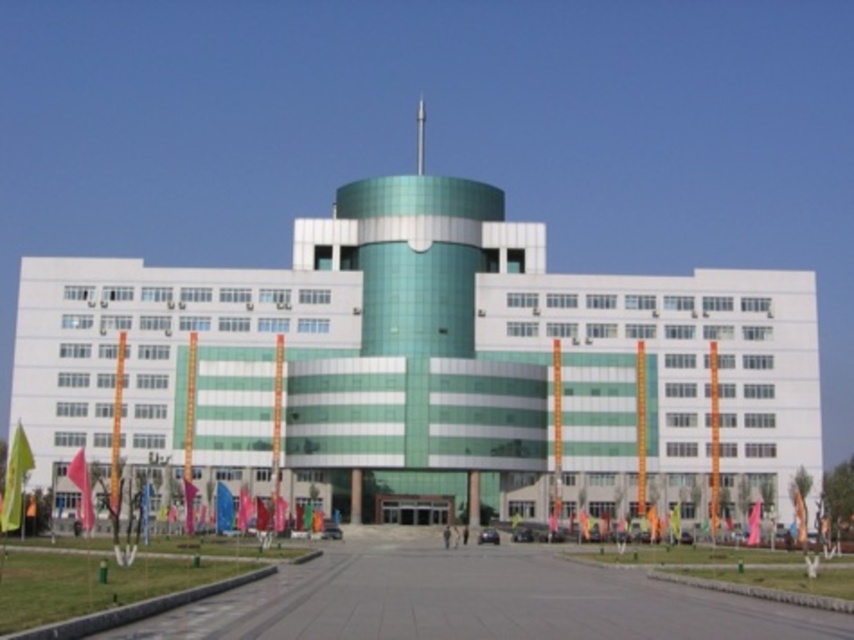
Question: Does green fabric flag at lower left appear on the left side of green fabric flag at center?

Choices:
 (A) no
 (B) yes

Answer: (B)

Question: Can you confirm if green glass building at center is positioned above green fabric flag at lower left?

Choices:
 (A) yes
 (B) no

Answer: (A)

Question: Is green fabric flag at lower left to the right of green fabric flag at lower right from the viewer's perspective?

Choices:
 (A) yes
 (B) no

Answer: (B)

Question: Considering the real-world distances, which object is farthest from the green fabric flag at lower left?

Choices:
 (A) green fabric flag at center
 (B) green fabric flag at lower right
 (C) red fabric flag at lower left
 (D) green glass building at center

Answer: (B)

Question: Which object is the closest to the green glass building at center?

Choices:
 (A) green fabric flag at center
 (B) green fabric flag at lower right
 (C) green fabric flag at lower left
 (D) red fabric flag at lower left

Answer: (A)

Question: Which point is closer to the camera?

Choices:
 (A) red fabric flag at lower left
 (B) green glass building at center
 (C) green fabric flag at lower left
 (D) green fabric flag at lower right

Answer: (C)